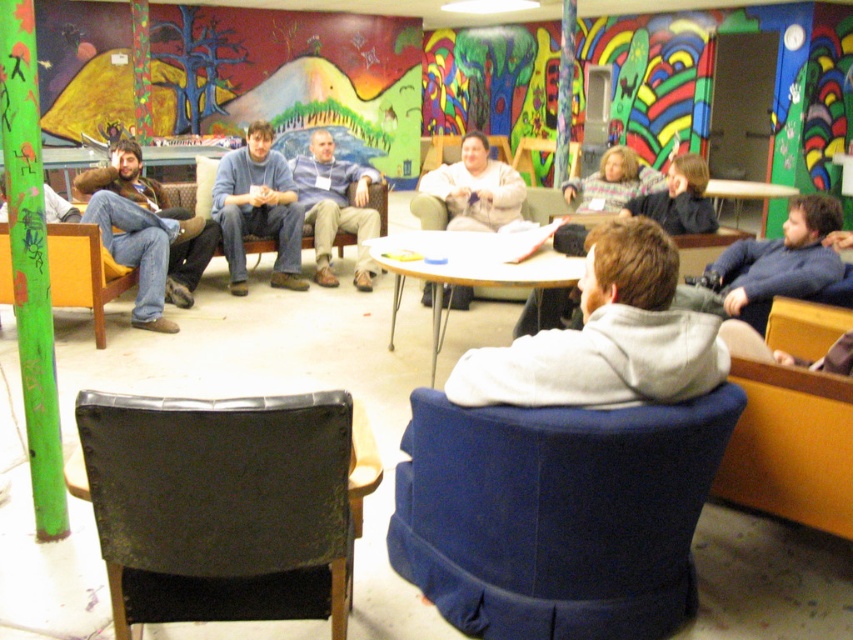
Question: Does blue fabric swivel chair at center have a smaller size compared to black leather swivel chair at lower left?

Choices:
 (A) yes
 (B) no

Answer: (B)

Question: Which object is positioned closest to the blue fabric swivel chair at center?

Choices:
 (A) dark blue sweater at right
 (B) jeans at left
 (C) wooden round table at center
 (D) black leather swivel chair at lower left

Answer: (D)

Question: Where is dark blue sweater at right located in relation to blue denim jeans at center in the image?

Choices:
 (A) above
 (B) below

Answer: (B)

Question: Which object is positioned farthest from the wooden round table at center?

Choices:
 (A) dark blue sweater at right
 (B) blue denim jeans at center
 (C) blue fabric swivel chair at center

Answer: (B)

Question: Among these points, which one is nearest to the camera?

Choices:
 (A) click(161, 273)
 (B) click(276, 456)

Answer: (B)

Question: Does jeans at left appear over blue denim jeans at center?

Choices:
 (A) no
 (B) yes

Answer: (A)